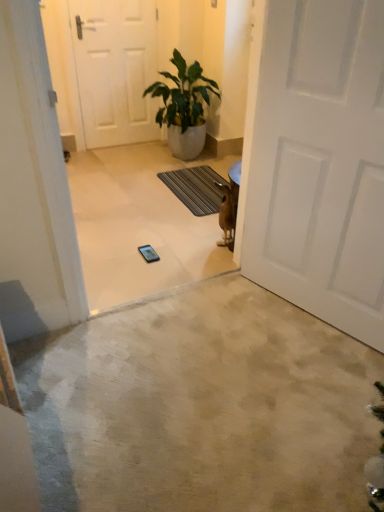
Question: Should I look upward or downward to see dark gray textured mat at center?

Choices:
 (A) down
 (B) up

Answer: (B)

Question: Is beige carpet at center positioned far away from dark gray textured mat at center?

Choices:
 (A) no
 (B) yes

Answer: (B)

Question: Is beige carpet at center thinner than dark gray textured mat at center?

Choices:
 (A) no
 (B) yes

Answer: (A)

Question: Is beige carpet at center bigger than dark gray textured mat at center?

Choices:
 (A) no
 (B) yes

Answer: (B)

Question: Is beige carpet at center further to the viewer compared to dark gray textured mat at center?

Choices:
 (A) yes
 (B) no

Answer: (B)

Question: From the image's perspective, is beige carpet at center under dark gray textured mat at center?

Choices:
 (A) yes
 (B) no

Answer: (A)

Question: Can you confirm if beige carpet at center is wider than dark gray textured mat at center?

Choices:
 (A) yes
 (B) no

Answer: (A)

Question: Considering the relative sizes of dark gray textured mat at center and white matte door at center, the second door in the left-to-right sequence, in the image provided, is dark gray textured mat at center wider than white matte door at center, the second door in the left-to-right sequence,?

Choices:
 (A) no
 (B) yes

Answer: (B)

Question: From the image's perspective, is dark gray textured mat at center on top of white matte door at center, marked as the first door in a right-to-left arrangement?

Choices:
 (A) yes
 (B) no

Answer: (A)

Question: Considering the relative positions of dark gray textured mat at center and white matte door at center, the second door in the left-to-right sequence, in the image provided, is dark gray textured mat at center behind white matte door at center, the second door in the left-to-right sequence,?

Choices:
 (A) yes
 (B) no

Answer: (A)

Question: Does dark gray textured mat at center have a larger size compared to white matte door at center, marked as the first door in a right-to-left arrangement?

Choices:
 (A) no
 (B) yes

Answer: (A)

Question: Is dark gray textured mat at center oriented towards white matte door at center, marked as the first door in a right-to-left arrangement?

Choices:
 (A) yes
 (B) no

Answer: (B)

Question: Is dark gray textured mat at center looking in the opposite direction of white matte door at center, which is the first door from bottom to top?

Choices:
 (A) yes
 (B) no

Answer: (B)

Question: Are white matte door at center, marked as the first door in a right-to-left arrangement, and dark gray textured mat at center far apart?

Choices:
 (A) no
 (B) yes

Answer: (B)